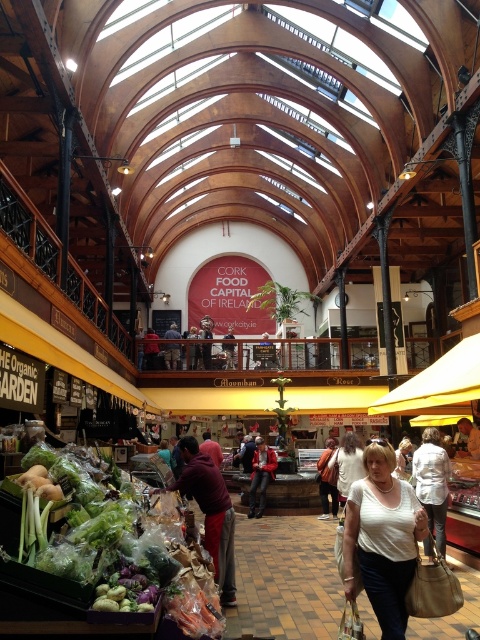
Question: Can you confirm if maroon sweater at center is bigger than white fabric shirt at center?

Choices:
 (A) yes
 (B) no

Answer: (B)

Question: Can you confirm if green leafy vegetables at lower left is positioned to the left of white matte shirt at center?

Choices:
 (A) no
 (B) yes

Answer: (B)

Question: Among these points, which one is nearest to the camera?

Choices:
 (A) (385, 602)
 (B) (92, 582)

Answer: (B)

Question: Which point appears closest to the camera in this image?

Choices:
 (A) (373, 554)
 (B) (250, 497)
 (C) (90, 465)

Answer: (A)

Question: In this image, where is white matte shirt at center located relative to maroon sweater at center?

Choices:
 (A) right
 (B) left

Answer: (A)

Question: Which of these objects is positioned closest to the maroon sweater at center?

Choices:
 (A) white fabric shirt at center
 (B) green leafy vegetables at lower left
 (C) red leather jacket at center
 (D) white matte shirt at center

Answer: (B)